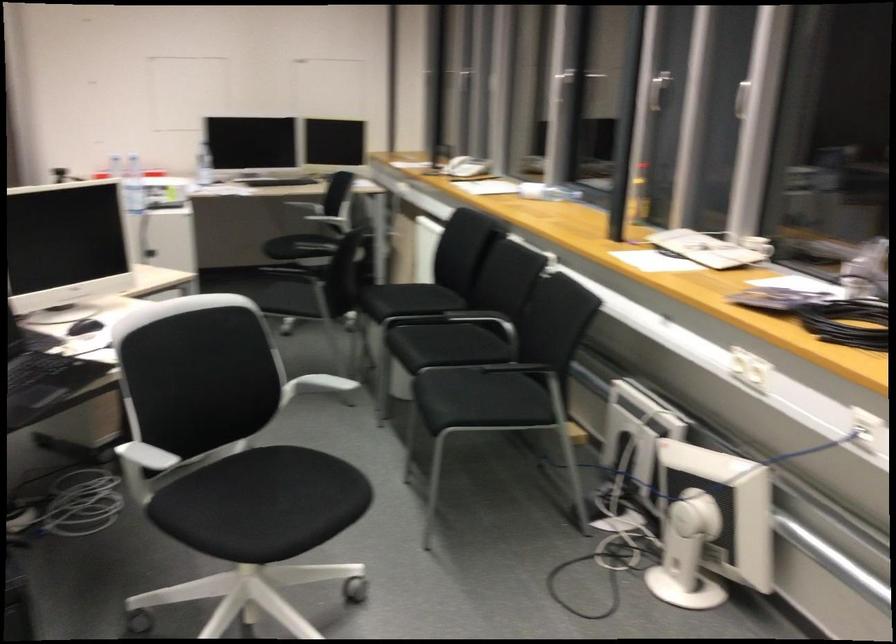
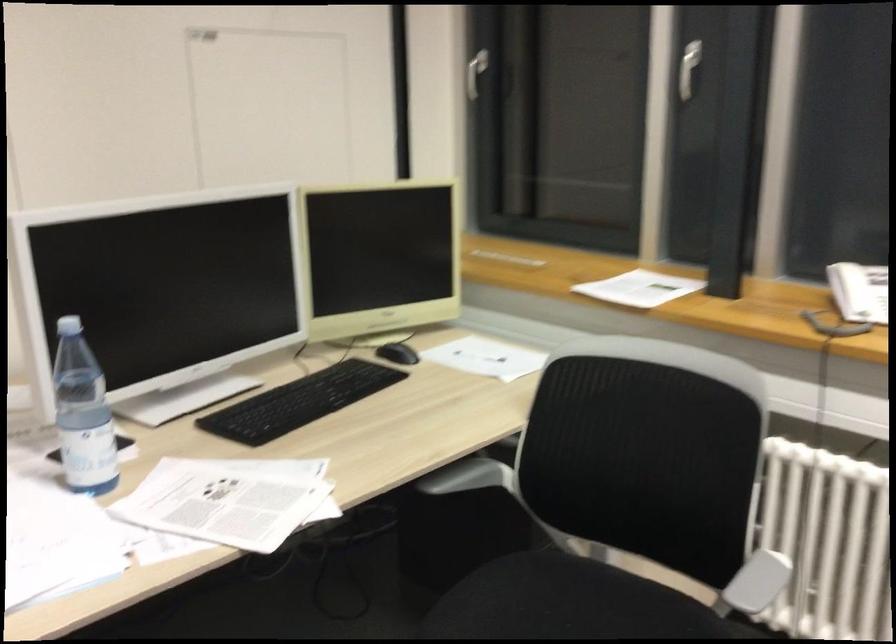
Locate, in the second image, the point that corresponds to point (332, 169) in the first image.

(398, 353)